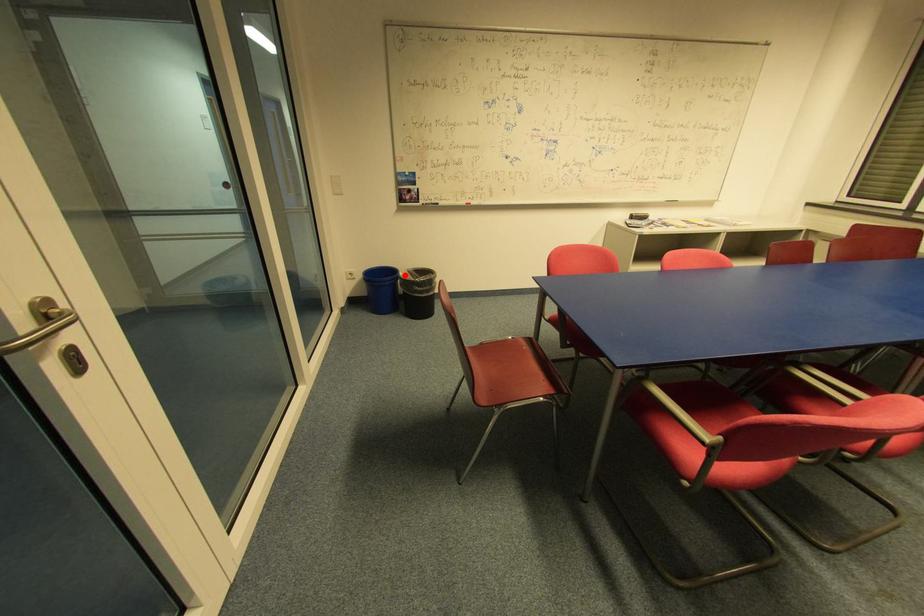
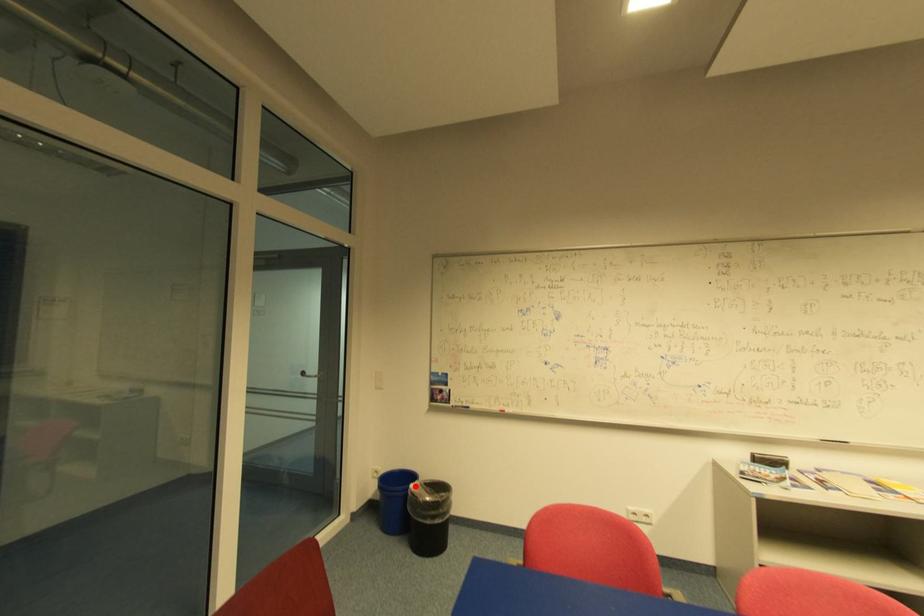
I am providing you with two images of the same scene from different viewpoints. A red point is marked on the first image and another point is marked on the second image. Do the highlighted points in image1 and image2 indicate the same real-world spot?

Yes